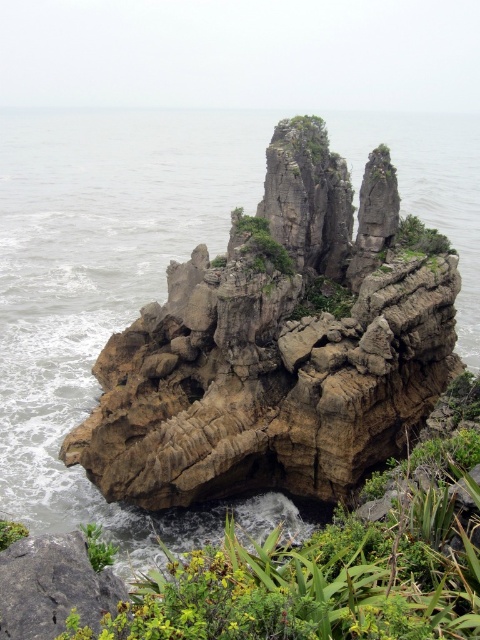
Who is lower down, green leafy plants at center or green leafy plant at lower left?

Positioned lower is green leafy plant at lower left.

The width and height of the screenshot is (480, 640). What do you see at coordinates (332, 568) in the screenshot? I see `green leafy plants at center` at bounding box center [332, 568].

Who is more forward, [459,516] or [6,545]?

Point [459,516] is more forward.

At what (x,y) coordinates should I click in order to perform the action: click on green leafy plants at center. Please return your answer as a coordinate pair (x, y). Looking at the image, I should click on (332, 568).

Does green leafy shrub at upper right appear under green leafy plant at lower left?

No, green leafy shrub at upper right is not below green leafy plant at lower left.

Between green leafy shrub at upper right and green leafy plant at lower left, which one has more height?

Standing taller between the two is green leafy plant at lower left.

Does point (448, 241) come closer to viewer compared to point (20, 525)?

No, (448, 241) is further to viewer.

This screenshot has height=640, width=480. Identify the location of green leafy shrub at upper right. (420, 236).

Does gray water at center have a lesser height compared to green leafy shrub at upper right?

Incorrect, gray water at center's height does not fall short of green leafy shrub at upper right's.

Can you confirm if gray water at center is positioned below green leafy shrub at upper right?

Incorrect, gray water at center is not positioned below green leafy shrub at upper right.

Does point (69, 356) lie in front of point (448, 250)?

No, it is behind (448, 250).

Where is `gray water at center`? gray water at center is located at coordinates (96, 268).